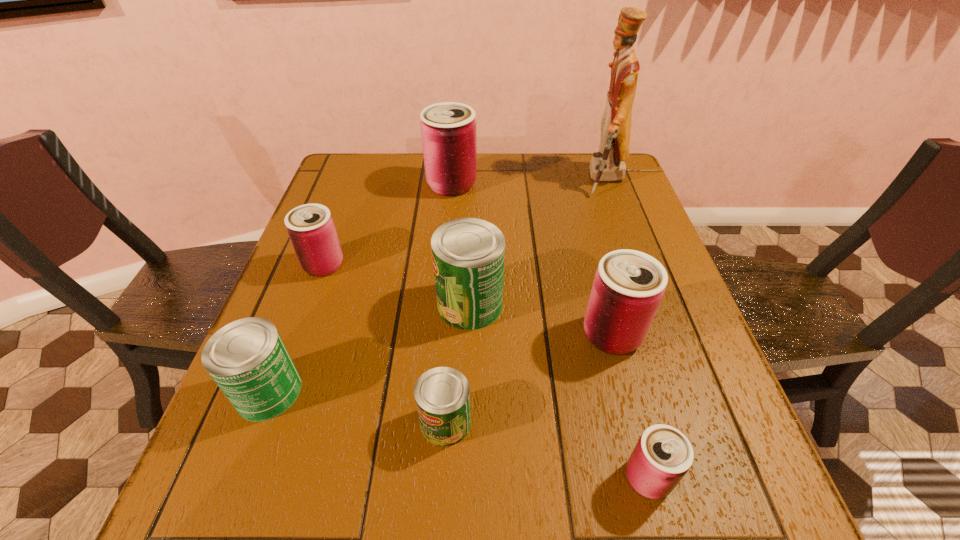
Where is `blank area in the image that satisfies the following two spatial constraints: 1. on the back side of the second biggest green can; 2. on the right side of the second biggest pink can`? blank area in the image that satisfies the following two spatial constraints: 1. on the back side of the second biggest green can; 2. on the right side of the second biggest pink can is located at coordinates (291, 334).

Locate an element on the screen. The image size is (960, 540). vacant space that satisfies the following two spatial constraints: 1. on the back side of the leftmost green can; 2. on the right side of the third biggest pink can is located at coordinates (318, 265).

Locate an element on the screen. free location that satisfies the following two spatial constraints: 1. on the front side of the second smallest green can; 2. on the right side of the nearest can is located at coordinates (237, 478).